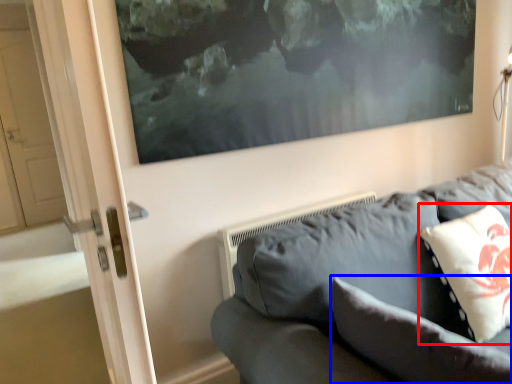
Question: Which point is closer to the camera, pillow (highlighted by a red box) or pillow (highlighted by a blue box)?

Choices:
 (A) pillow
 (B) pillow

Answer: (B)